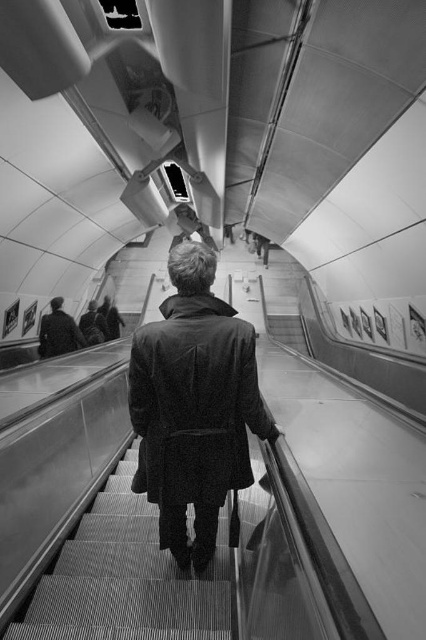
Between point (198, 344) and point (60, 305), which one is positioned behind?

Point (60, 305)

Is dark wool coat at center to the left of dark gray coat at upper center from the viewer's perspective?

In fact, dark wool coat at center is to the right of dark gray coat at upper center.

Locate an element on the screen. Image resolution: width=426 pixels, height=640 pixels. dark wool coat at center is located at coordinates (195, 404).

Who is taller, textured carpet stairs at center or dark gray coat at upper center?

Standing taller between the two is dark gray coat at upper center.

Between textured carpet stairs at center and dark gray coat at upper center, which one appears on the right side from the viewer's perspective?

From the viewer's perspective, textured carpet stairs at center appears more on the right side.

Does point (155, 552) come farther from viewer compared to point (78, 339)?

No.

Locate an element on the screen. Image resolution: width=426 pixels, height=640 pixels. textured carpet stairs at center is located at coordinates (124, 579).

Which of these two, dark wool coat at center or textured carpet stairs at center, stands shorter?

textured carpet stairs at center

Between dark wool coat at center and textured carpet stairs at center, which one appears on the right side from the viewer's perspective?

Positioned to the right is dark wool coat at center.

Which is in front, point (256, 372) or point (150, 589)?

Positioned in front is point (256, 372).

Identify the location of dark wool coat at center. Image resolution: width=426 pixels, height=640 pixels. (195, 404).